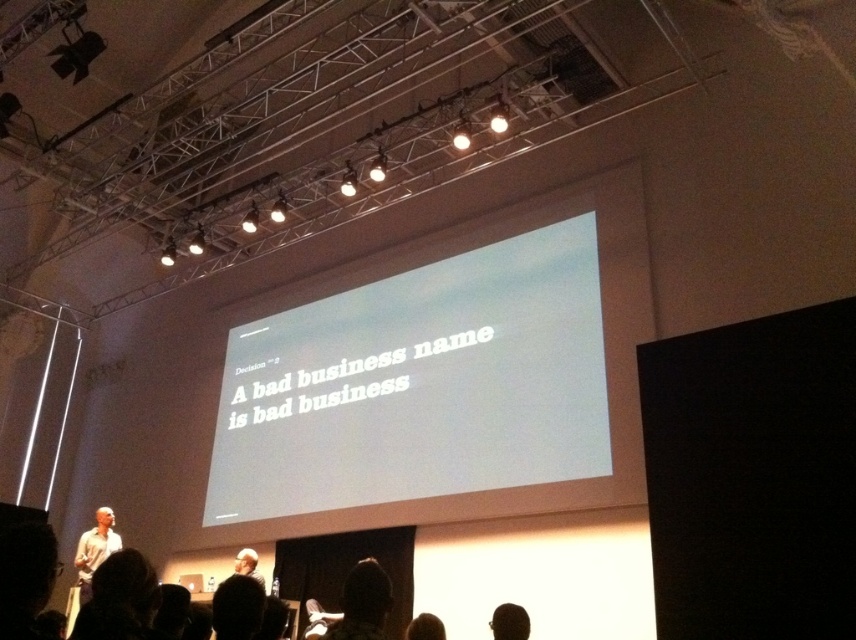
Question: Does light brown hair at lower left come in front of white hair at center?

Choices:
 (A) no
 (B) yes

Answer: (B)

Question: Is white matte projection screen at center bigger than white shirt at lower left?

Choices:
 (A) no
 (B) yes

Answer: (B)

Question: Which object is the closest to the light brown hair at lower left?

Choices:
 (A) dark brown hair at lower center
 (B) brown hair at lower center
 (C) dark hair at lower center

Answer: (C)

Question: Which object appears closest to the camera in this image?

Choices:
 (A) brown hair at lower center
 (B) white hair at center
 (C) light brown hair at lower left
 (D) dark brown hair at lower center

Answer: (C)

Question: Can you confirm if light brown hair at lower left is positioned below dark hair at lower center?

Choices:
 (A) yes
 (B) no

Answer: (B)

Question: Among these points, which one is farthest from the camera?

Choices:
 (A) (376, 630)
 (B) (100, 545)

Answer: (B)